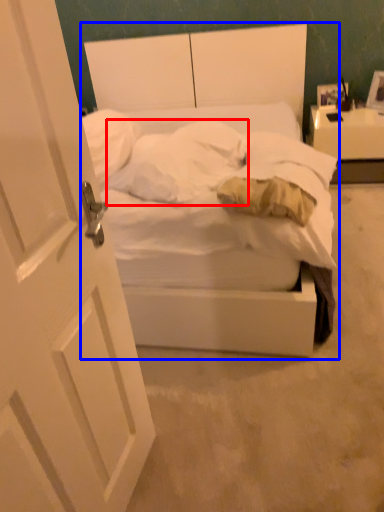
Question: Among these objects, which one is nearest to the camera, pillow (highlighted by a red box) or bed (highlighted by a blue box)?

Choices:
 (A) pillow
 (B) bed

Answer: (B)